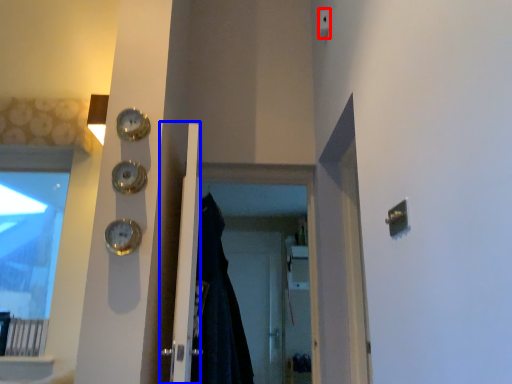
Question: Which of the following is the farthest to the observer, light switch (highlighted by a red box) or door (highlighted by a blue box)?

Choices:
 (A) light switch
 (B) door

Answer: (A)